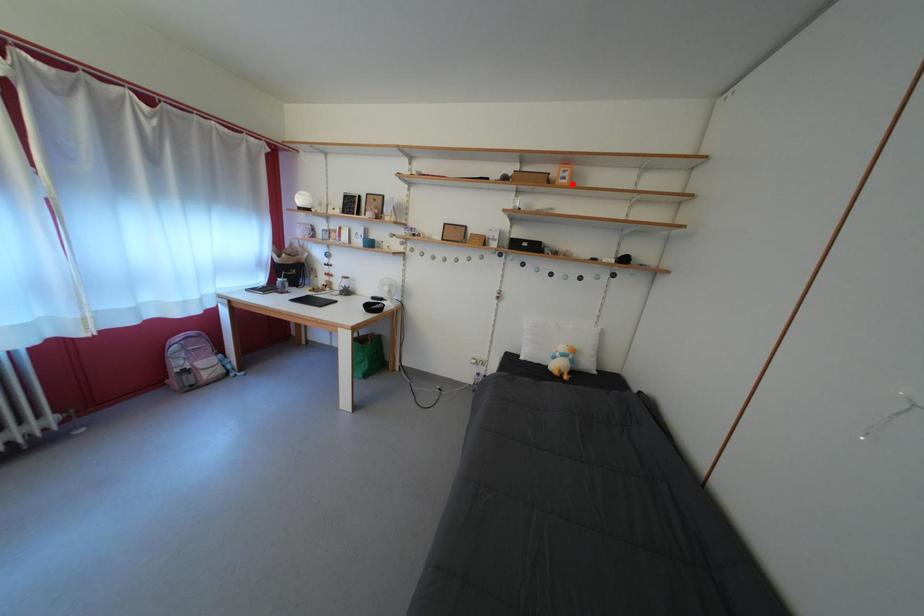
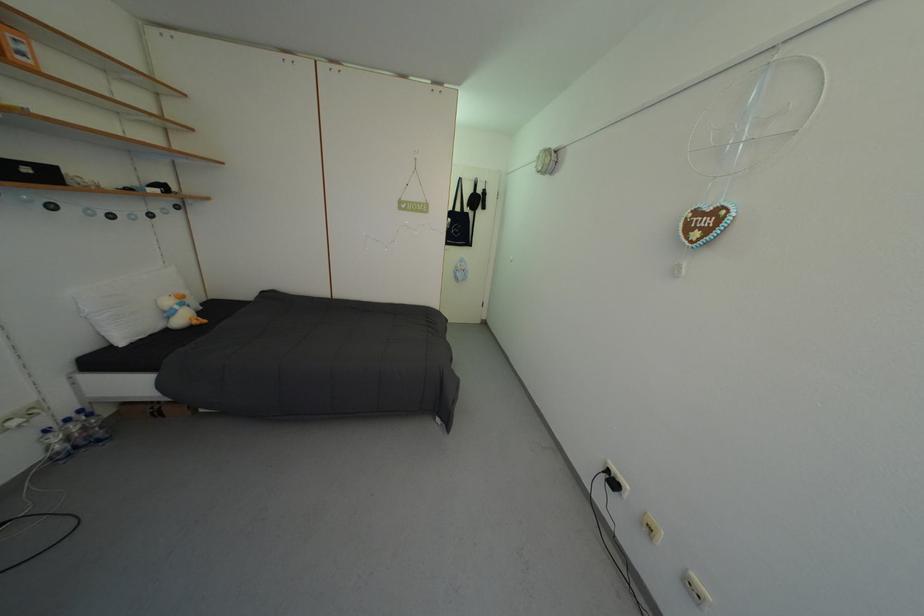
Question: I am providing you with two images of the same scene from different viewpoints. A red point is shown in image1. For the corresponding object point in image2, is it positioned nearer or farther from the camera?

Choices:
 (A) Nearer
 (B) Farther

Answer: (B)